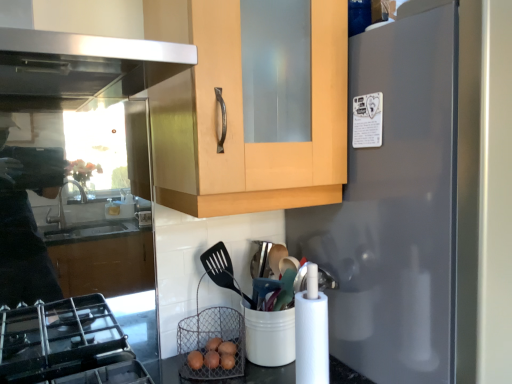
You are a GUI agent. You are given a task and a screenshot of the screen. Output one action in this format:
    pyautogui.click(x=<x>, y=<y>)
    Task: Click on the brown wire basket at lower center
    
    Given the screenshot: What is the action you would take?
    pyautogui.click(x=210, y=338)

The height and width of the screenshot is (384, 512). What do you see at coordinates (210, 338) in the screenshot?
I see `brown wire basket at lower center` at bounding box center [210, 338].

Describe the element at coordinates (395, 209) in the screenshot. I see `satin gray refrigerator at right` at that location.

Where is `satin gray refrigerator at right`? satin gray refrigerator at right is located at coordinates [395, 209].

Identify the location of brown wire basket at lower center. Image resolution: width=512 pixels, height=384 pixels. (210, 338).

Does brown wire basket at lower center appear on the left side of satin gray refrigerator at right?

Yes, brown wire basket at lower center is to the left of satin gray refrigerator at right.

Is the position of brown wire basket at lower center more distant than that of satin gray refrigerator at right?

Yes, it is.

Considering the positions of points (178, 326) and (349, 355), is point (178, 326) closer to camera compared to point (349, 355)?

No.

From the image's perspective, is brown wire basket at lower center under satin gray refrigerator at right?

Correct, brown wire basket at lower center appears lower than satin gray refrigerator at right in the image.

From a real-world perspective, which object stands above the other?

satin gray refrigerator at right, from a real-world perspective.

Is brown wire basket at lower center wider or thinner than satin gray refrigerator at right?

Clearly, brown wire basket at lower center has less width compared to satin gray refrigerator at right.

Is brown wire basket at lower center taller than satin gray refrigerator at right?

No.

Considering the relative sizes of brown wire basket at lower center and satin gray refrigerator at right in the image provided, is brown wire basket at lower center bigger than satin gray refrigerator at right?

Actually, brown wire basket at lower center might be smaller than satin gray refrigerator at right.

Based on the photo, is brown wire basket at lower center outside of satin gray refrigerator at right?

Absolutely, brown wire basket at lower center is external to satin gray refrigerator at right.

Would you say brown wire basket at lower center is a long distance from satin gray refrigerator at right?

No.

Is brown wire basket at lower center facing towards satin gray refrigerator at right?

No, brown wire basket at lower center is not aimed at satin gray refrigerator at right.

How different are the orientations of brown wire basket at lower center and satin gray refrigerator at right in degrees?

There is a 29.6-degree angle between the facing directions of brown wire basket at lower center and satin gray refrigerator at right.

How distant is brown wire basket at lower center from satin gray refrigerator at right?

brown wire basket at lower center is 18.44 inches away from satin gray refrigerator at right.

Identify the location of refrigerator that appears on the right of brown wire basket at lower center. The width and height of the screenshot is (512, 384). (395, 209).

Considering the positions of objects satin gray refrigerator at right and brown wire basket at lower center in the image provided, who is more to the left, satin gray refrigerator at right or brown wire basket at lower center?

brown wire basket at lower center is more to the left.

In the scene shown: Does satin gray refrigerator at right come behind brown wire basket at lower center?

No, satin gray refrigerator at right is closer to the viewer.

Does point (368, 279) lie behind point (203, 341)?

No.

From the image's perspective, between satin gray refrigerator at right and brown wire basket at lower center, which one is located above?

From the image's view, satin gray refrigerator at right is above.

From a real-world perspective, is satin gray refrigerator at right located beneath brown wire basket at lower center?

Actually, satin gray refrigerator at right is physically above brown wire basket at lower center in the real world.

Between satin gray refrigerator at right and brown wire basket at lower center, which one has larger width?

satin gray refrigerator at right.

Between satin gray refrigerator at right and brown wire basket at lower center, which one has less height?

brown wire basket at lower center.

Who is bigger, satin gray refrigerator at right or brown wire basket at lower center?

With larger size is satin gray refrigerator at right.

Is satin gray refrigerator at right not within brown wire basket at lower center?

Yes, satin gray refrigerator at right is not within brown wire basket at lower center.

Is satin gray refrigerator at right not near brown wire basket at lower center?

satin gray refrigerator at right is near brown wire basket at lower center, not far away.

From the picture: Is satin gray refrigerator at right positioned with its back to brown wire basket at lower center?

satin gray refrigerator at right does not have its back to brown wire basket at lower center.

How many degrees apart are the facing directions of satin gray refrigerator at right and brown wire basket at lower center?

29.6 degrees separate the facing orientations of satin gray refrigerator at right and brown wire basket at lower center.

Locate an element on the screen. refrigerator above the brown wire basket at lower center (from the image's perspective) is located at coordinates (395, 209).

Locate an element on the screen. refrigerator in front of the brown wire basket at lower center is located at coordinates (395, 209).

You are a GUI agent. You are given a task and a screenshot of the screen. Output one action in this format:
    pyautogui.click(x=<x>, y=<y>)
    Task: Click on the basket below the satin gray refrigerator at right (from a real-world perspective)
    The height and width of the screenshot is (384, 512).
    Given the screenshot: What is the action you would take?
    pyautogui.click(x=210, y=338)